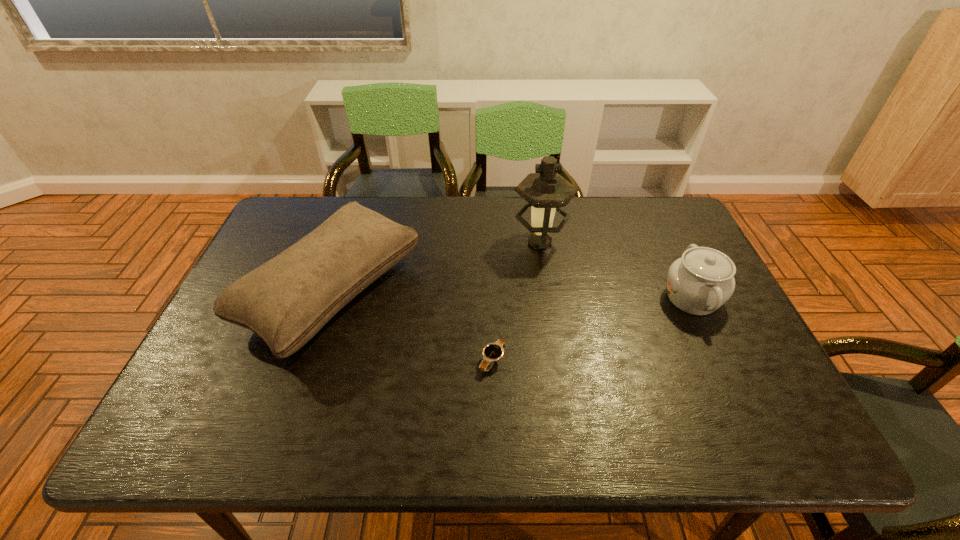
This screenshot has width=960, height=540. Identify the location of object that stands as the second closest to the rightmost object. (492, 352).

This screenshot has width=960, height=540. Identify the location of vacant position in the image that satisfies the following two spatial constraints: 1. on the front side of the rightmost object; 2. on the left side of the leftmost object. (330, 298).